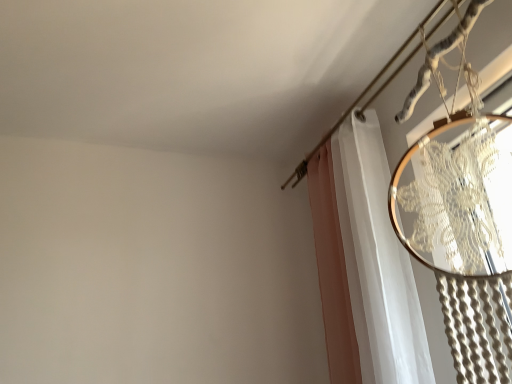
Question: Does white sheer curtain at upper right touch metallic silver clothesline at upper right?

Choices:
 (A) no
 (B) yes

Answer: (A)

Question: Could you tell me if white sheer curtain at upper right is facing metallic silver clothesline at upper right?

Choices:
 (A) yes
 (B) no

Answer: (A)

Question: Is white sheer curtain at upper right positioned beyond the bounds of metallic silver clothesline at upper right?

Choices:
 (A) no
 (B) yes

Answer: (B)

Question: Is white sheer curtain at upper right positioned before metallic silver clothesline at upper right?

Choices:
 (A) yes
 (B) no

Answer: (B)

Question: Considering the relative sizes of white sheer curtain at upper right and metallic silver clothesline at upper right in the image provided, is white sheer curtain at upper right shorter than metallic silver clothesline at upper right?

Choices:
 (A) yes
 (B) no

Answer: (B)

Question: Are white sheer curtain at upper right and metallic silver clothesline at upper right far apart?

Choices:
 (A) yes
 (B) no

Answer: (B)

Question: Is metallic silver clothesline at upper right positioned behind white sheer curtain at upper right?

Choices:
 (A) yes
 (B) no

Answer: (B)

Question: Is metallic silver clothesline at upper right smaller than white sheer curtain at upper right?

Choices:
 (A) yes
 (B) no

Answer: (A)

Question: Is metallic silver clothesline at upper right at the left side of white sheer curtain at upper right?

Choices:
 (A) yes
 (B) no

Answer: (B)

Question: From a real-world perspective, is metallic silver clothesline at upper right positioned over white sheer curtain at upper right based on gravity?

Choices:
 (A) no
 (B) yes

Answer: (B)

Question: Does metallic silver clothesline at upper right have a larger size compared to white sheer curtain at upper right?

Choices:
 (A) yes
 (B) no

Answer: (B)

Question: Can you confirm if metallic silver clothesline at upper right is wider than white sheer curtain at upper right?

Choices:
 (A) no
 (B) yes

Answer: (B)

Question: Based on their positions, is white sheer curtain at upper right located to the left or right of metallic silver clothesline at upper right?

Choices:
 (A) left
 (B) right

Answer: (A)